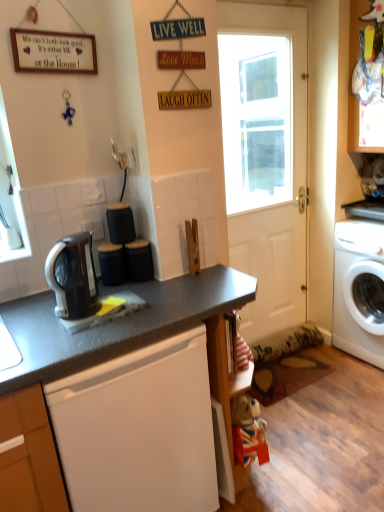
In order to click on free space in front of black glossy coffee maker at left in this screenshot , I will do `click(78, 333)`.